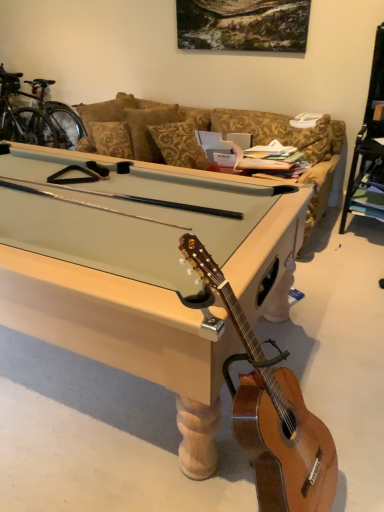
Question: Does shiny metallic bicycle at upper left lie behind light wood pool table at center?

Choices:
 (A) yes
 (B) no

Answer: (A)

Question: Considering the relative sizes of shiny metallic bicycle at upper left and light wood pool table at center in the image provided, is shiny metallic bicycle at upper left thinner than light wood pool table at center?

Choices:
 (A) no
 (B) yes

Answer: (B)

Question: Is shiny metallic bicycle at upper left at the left side of light wood pool table at center?

Choices:
 (A) yes
 (B) no

Answer: (A)

Question: Can you confirm if shiny metallic bicycle at upper left is positioned to the right of light wood pool table at center?

Choices:
 (A) no
 (B) yes

Answer: (A)

Question: Is shiny metallic bicycle at upper left positioned with its back to light wood pool table at center?

Choices:
 (A) yes
 (B) no

Answer: (B)

Question: In terms of height, does light brown wood guitar at lower right look taller or shorter compared to shiny metallic bicycle at upper left?

Choices:
 (A) short
 (B) tall

Answer: (A)

Question: In terms of size, does light brown wood guitar at lower right appear bigger or smaller than shiny metallic bicycle at upper left?

Choices:
 (A) big
 (B) small

Answer: (B)

Question: Is light brown wood guitar at lower right to the left or to the right of shiny metallic bicycle at upper left in the image?

Choices:
 (A) left
 (B) right

Answer: (B)

Question: From the image's perspective, is light brown wood guitar at lower right positioned above or below shiny metallic bicycle at upper left?

Choices:
 (A) below
 (B) above

Answer: (A)

Question: From a real-world perspective, is shiny metallic bicycle at upper left positioned above or below light wood pool table at center?

Choices:
 (A) above
 (B) below

Answer: (A)

Question: Does point (54, 144) appear closer or farther from the camera than point (8, 290)?

Choices:
 (A) farther
 (B) closer

Answer: (A)

Question: Considering the positions of shiny metallic bicycle at upper left and light wood pool table at center in the image, is shiny metallic bicycle at upper left bigger or smaller than light wood pool table at center?

Choices:
 (A) big
 (B) small

Answer: (A)

Question: In the image, is shiny metallic bicycle at upper left on the left side or the right side of light wood pool table at center?

Choices:
 (A) left
 (B) right

Answer: (A)

Question: From a real-world perspective, is light brown wood guitar at lower right physically located above or below light wood pool table at center?

Choices:
 (A) above
 (B) below

Answer: (A)

Question: In terms of width, does light brown wood guitar at lower right look wider or thinner when compared to light wood pool table at center?

Choices:
 (A) wide
 (B) thin

Answer: (B)